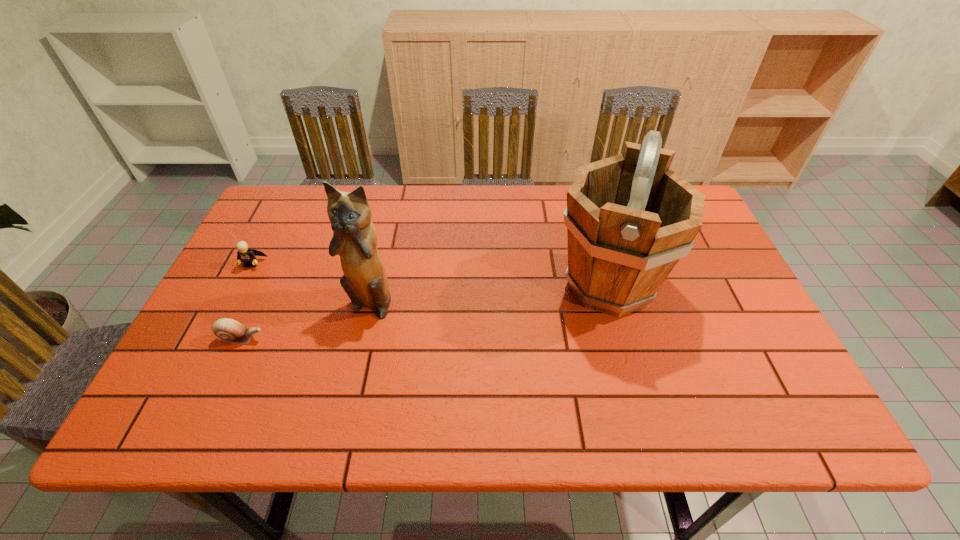
I want to click on free space that satisfies the following two spatial constraints: 1. on the front-facing side of the Lego; 2. on the left side of the rightmost object, so click(241, 286).

Where is `vacant area in the image that satisfies the following two spatial constraints: 1. on the face of the cat; 2. on the front-facing side of the escargot`? This screenshot has width=960, height=540. vacant area in the image that satisfies the following two spatial constraints: 1. on the face of the cat; 2. on the front-facing side of the escargot is located at coordinates coord(362,339).

Locate an element on the screen. vacant space that satisfies the following two spatial constraints: 1. on the front-facing side of the second shortest object; 2. on the right side of the tallest object is located at coordinates (241, 286).

At what (x,y) coordinates should I click in order to perform the action: click on blank area in the image that satisfies the following two spatial constraints: 1. on the front-facing side of the Lego; 2. on the right side of the bucket. Please return your answer as a coordinate pair (x, y). The height and width of the screenshot is (540, 960). Looking at the image, I should click on (241, 286).